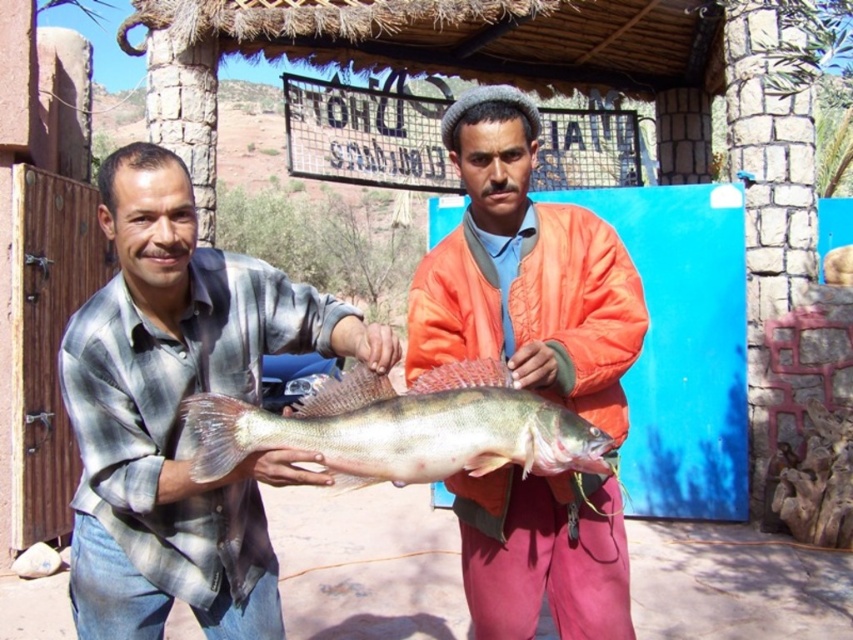
Can you confirm if plaid shirt at center is thinner than orange quilted jacket at center?

In fact, plaid shirt at center might be wider than orange quilted jacket at center.

Who is more forward, (131, 616) or (489, 573)?

Point (131, 616)

Is point (260, 540) positioned after point (518, 616)?

No.

In order to click on plaid shirt at center in this screenshot , I will do `click(178, 413)`.

Does plaid shirt at center have a smaller size compared to shiny silver fish at center?

Incorrect, plaid shirt at center is not smaller in size than shiny silver fish at center.

Between plaid shirt at center and shiny silver fish at center, which one has more height?

plaid shirt at center

Does point (254, 465) come closer to viewer compared to point (189, 403)?

No, it is not.

The height and width of the screenshot is (640, 853). What are the coordinates of `plaid shirt at center` in the screenshot? It's located at (178, 413).

Does orange quilted jacket at center come behind shiny silver fish at center?

Yes, orange quilted jacket at center is behind shiny silver fish at center.

Can you confirm if orange quilted jacket at center is positioned below shiny silver fish at center?

No.

Measure the distance between orange quilted jacket at center and camera.

orange quilted jacket at center is 7.90 feet away from camera.

I want to click on orange quilted jacket at center, so click(x=525, y=273).